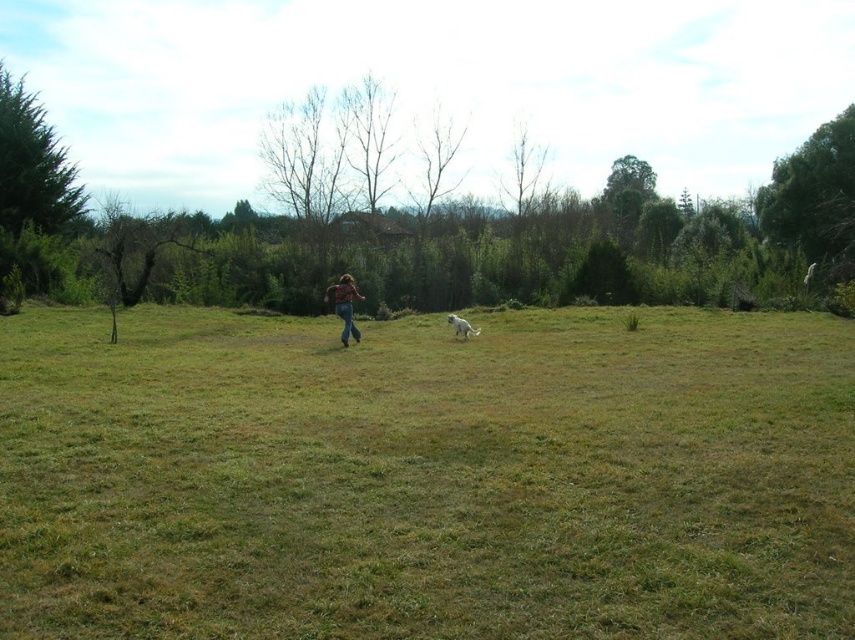
Which is more to the left, green grass at center or white fluffy dog at center?

white fluffy dog at center

Who is higher up, green grass at center or white fluffy dog at center?

white fluffy dog at center

Identify the location of green grass at center. This screenshot has width=855, height=640. (426, 476).

How far apart are brown leather jacket at center and white fluffy dog at center?

3.06 meters

Which is more to the left, brown leather jacket at center or white fluffy dog at center?

From the viewer's perspective, brown leather jacket at center appears more on the left side.

Is point (348, 337) behind point (469, 330)?

No, (348, 337) is closer to viewer.

The width and height of the screenshot is (855, 640). Identify the location of brown leather jacket at center. [x=345, y=305].

Does green grass at center lie behind brown leather jacket at center?

That is False.

Is point (34, 589) positioned after point (348, 284)?

That is False.

Which is in front, point (72, 627) or point (351, 317)?

Point (72, 627) is more forward.

In order to click on green grass at center in this screenshot , I will do `click(426, 476)`.